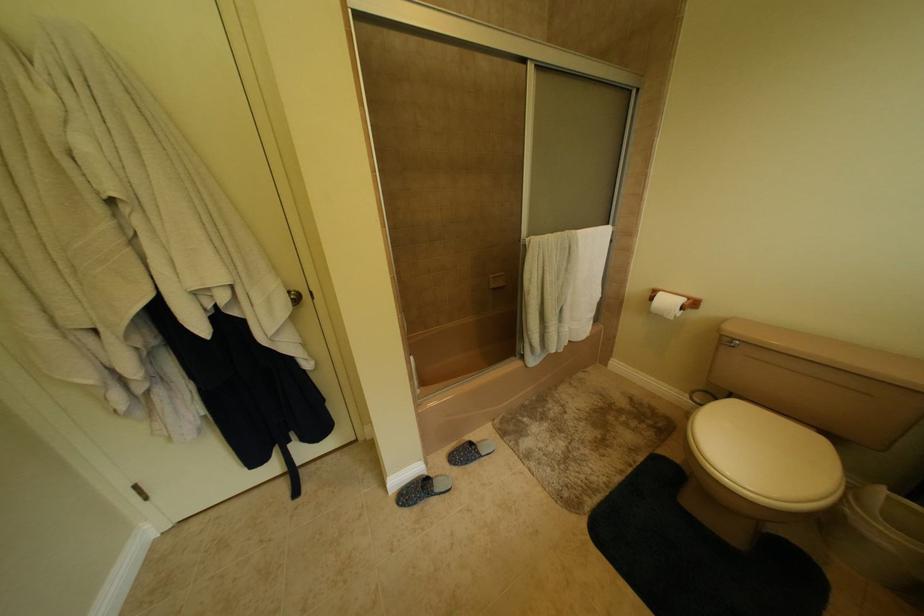
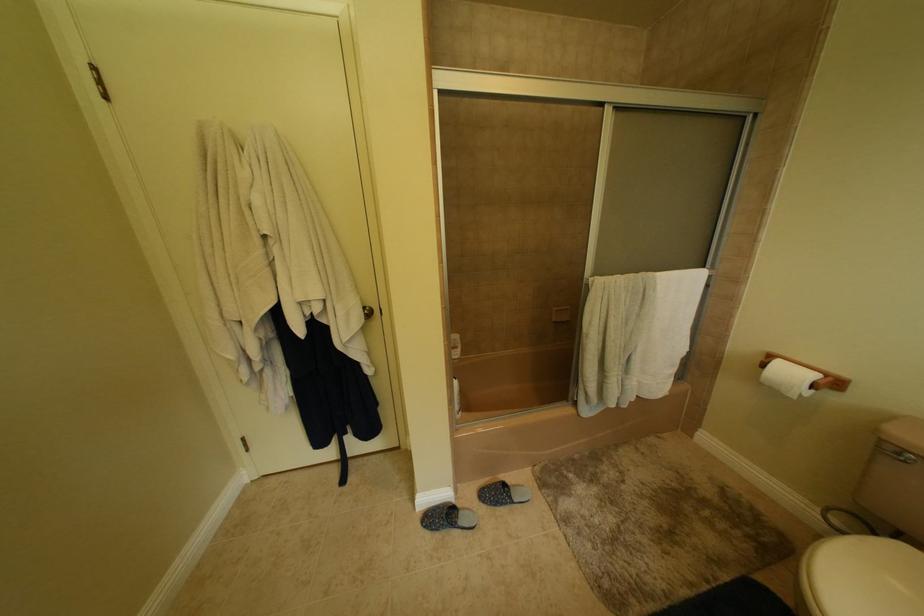
Question: The images are taken continuously from a first-person perspective. In which direction are you moving?

Choices:
 (A) Left
 (B) Right
 (C) Forward
 (D) Backward

Answer: (B)